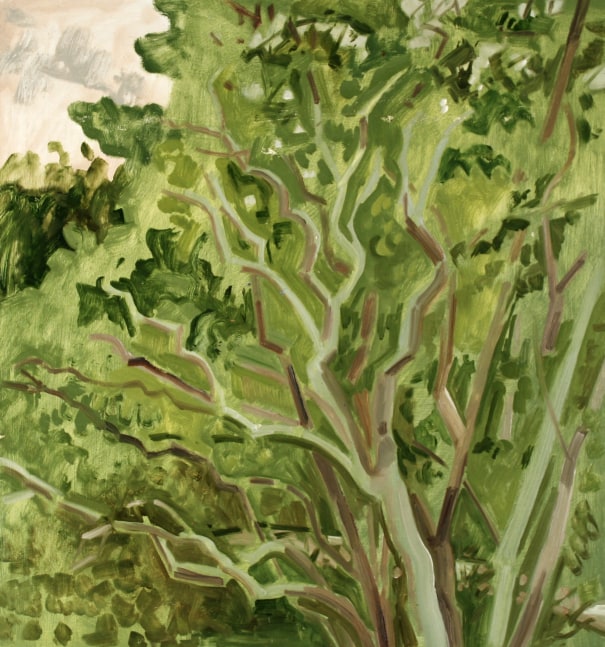
The height and width of the screenshot is (647, 605). Find the location of `dark green paint`. dark green paint is located at coordinates (269, 618), (220, 313), (54, 213), (103, 124), (460, 160), (486, 446), (408, 411), (498, 17).